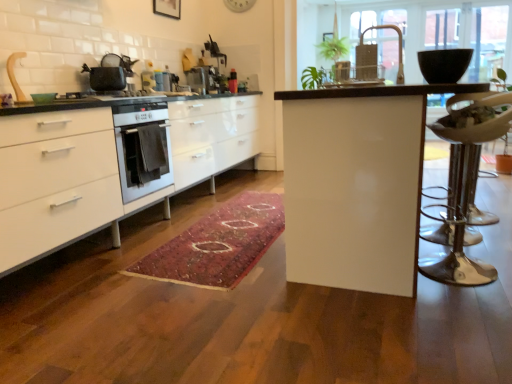
At what (x,y) coordinates should I click in order to perform the action: click on blank space situated above rug with intricate patterns at center (from a real-world perspective). Please return your answer as a coordinate pair (x, y). This screenshot has height=384, width=512. Looking at the image, I should click on (242, 218).